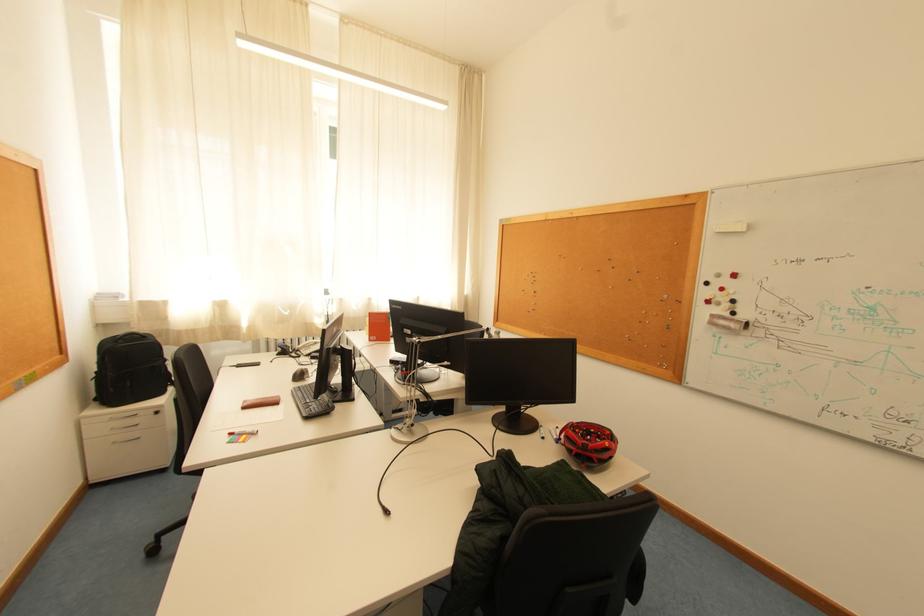
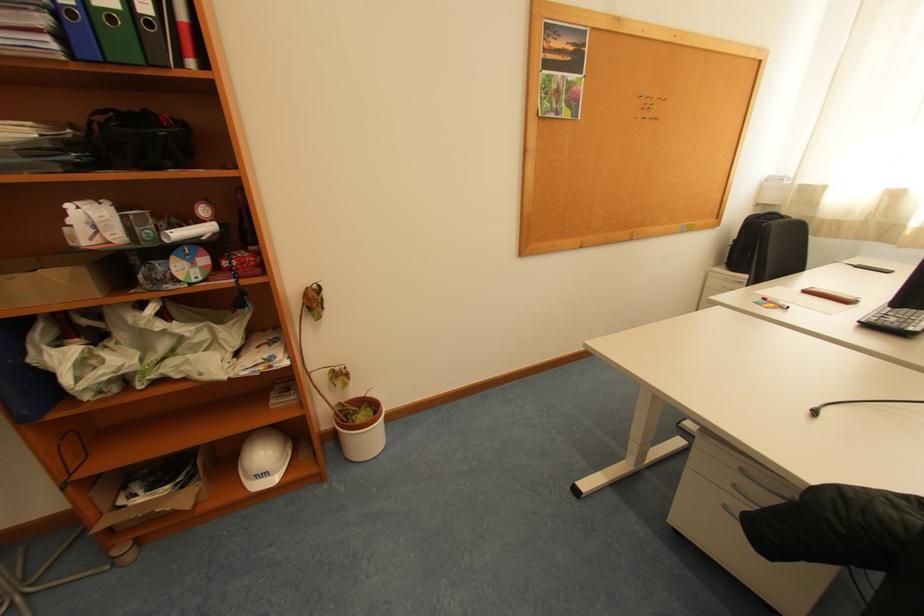
How did the camera likely rotate?

The camera's rotation is toward left-down.